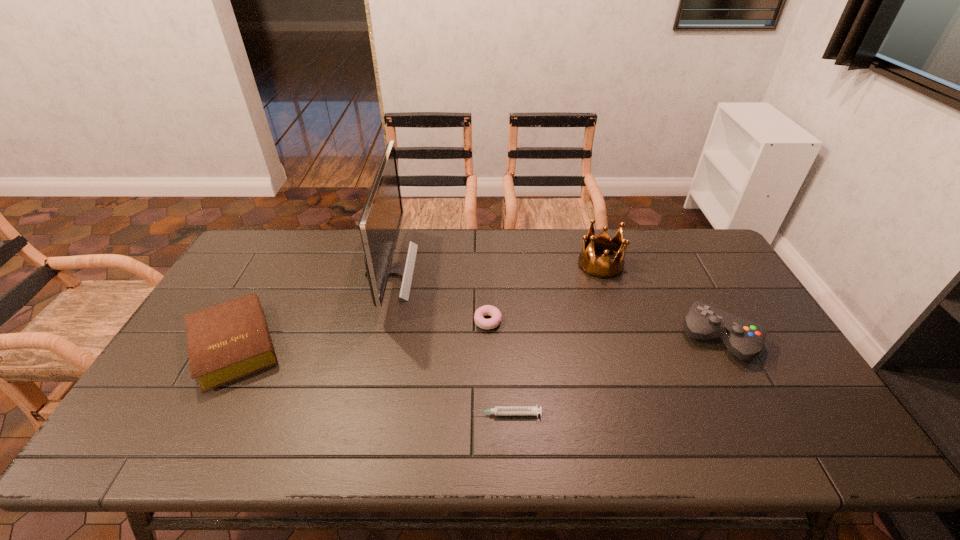
This screenshot has height=540, width=960. I want to click on free space between the fifth shortest object and the syringe, so click(x=553, y=339).

Where is `vacant area that lies between the fourth tallest object and the second shortest object`? Image resolution: width=960 pixels, height=540 pixels. vacant area that lies between the fourth tallest object and the second shortest object is located at coordinates (362, 334).

You are a GUI agent. You are given a task and a screenshot of the screen. Output one action in this format:
    pyautogui.click(x=<x>, y=<y>)
    Task: Click on the empty space between the leftmost object and the second object from left to right
    Image resolution: width=960 pixels, height=540 pixels.
    Given the screenshot: What is the action you would take?
    pyautogui.click(x=313, y=309)

This screenshot has height=540, width=960. Find the location of `empty location between the doughnut and the fifth object from right to left`. empty location between the doughnut and the fifth object from right to left is located at coordinates (439, 296).

The height and width of the screenshot is (540, 960). Identify the location of empty space between the fifth tallest object and the fourth shortest object. (604, 329).

Locate an element on the screen. The image size is (960, 540). free space between the third shortest object and the fifth tallest object is located at coordinates (362, 334).

This screenshot has width=960, height=540. Identify the location of object that ranks as the closest to the fifth tallest object. (380, 221).

Select which object appears as the second closest to the doughnut. Please provide its 2D coordinates. Your answer should be formatted as a tuple, i.e. [(x, y)], where the tuple contains the x and y coordinates of a point satisfying the conditions above.

[(498, 410)]

The image size is (960, 540). I want to click on vacant space that satisfies the following two spatial constraints: 1. on the screen side of the monitor; 2. on the left side of the doughnut, so click(378, 321).

This screenshot has width=960, height=540. I want to click on free point that satisfies the following two spatial constraints: 1. on the screen side of the second shortest object; 2. on the right side of the tallest object, so click(x=378, y=321).